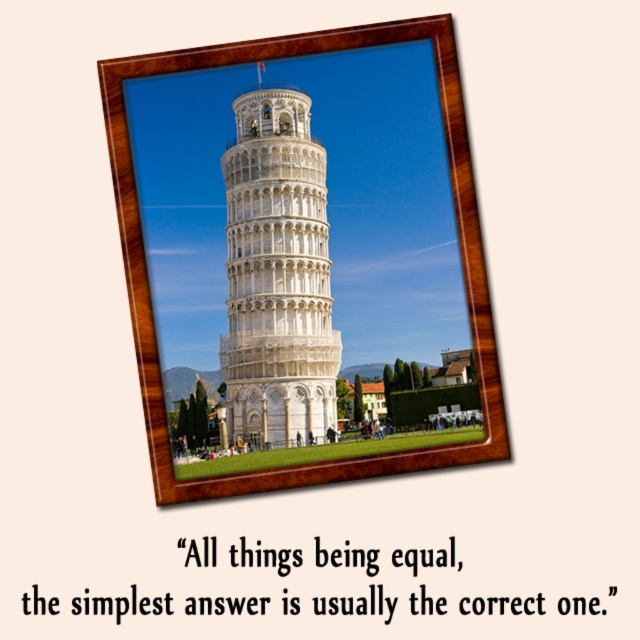
Does wooden frame at center have a greater height compared to white marble tower at center?

Yes.

From the picture: Does wooden frame at center have a lesser width compared to white marble tower at center?

In fact, wooden frame at center might be wider than white marble tower at center.

In order to click on wooden frame at center in this screenshot , I will do `click(300, 253)`.

Locate an element on the screen. The image size is (640, 640). wooden frame at center is located at coordinates [x=300, y=253].